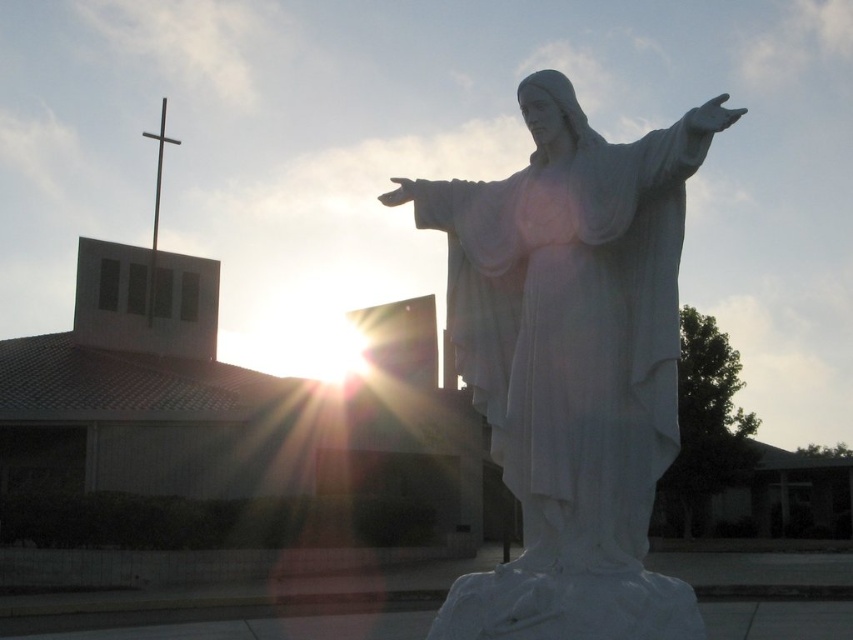
Is white marble statue at center positioned behind metallic cross at upper left?

No, white marble statue at center is closer to the viewer.

Who is more forward, [531,557] or [155,168]?

Positioned in front is point [531,557].

Identify the location of white marble statue at center. (572, 364).